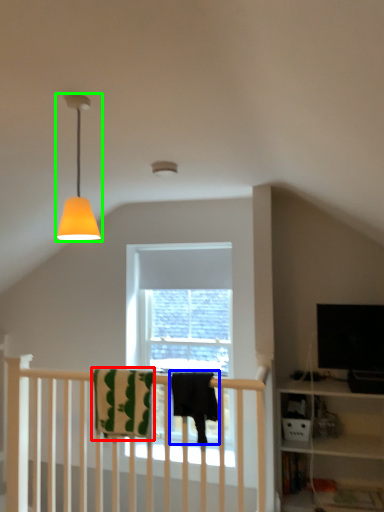
Question: Considering the real-world distances, which object is farthest from beach towel (highlighted by a red box)? beach towel (highlighted by a blue box) or lamp (highlighted by a green box)?

Choices:
 (A) beach towel
 (B) lamp

Answer: (B)